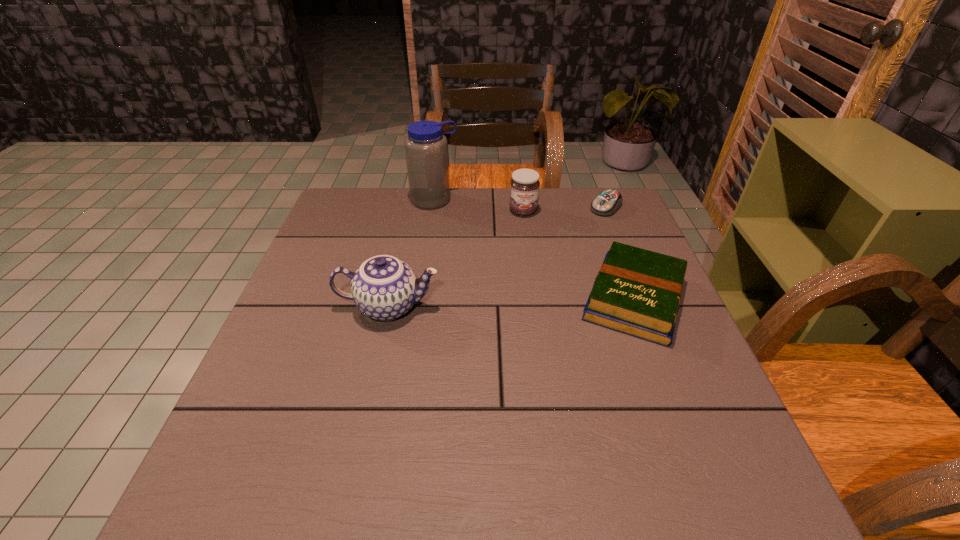
You are a GUI agent. You are given a task and a screenshot of the screen. Output one action in this format:
    pyautogui.click(x=<x>, y=<y>)
    Task: Click on the vacant spot on the desktop that is between the fourth shortest object and the book and is positioned with a carrying loop on the side of the water bottle
    The height and width of the screenshot is (540, 960).
    Given the screenshot: What is the action you would take?
    pyautogui.click(x=477, y=304)

What are the coordinates of `vacant space on the desktop that is between the chinaware and the book and is positioned on the front label of the jam` in the screenshot? It's located at (548, 302).

Locate an element on the screen. This screenshot has height=540, width=960. free spot on the desktop that is between the chinaware and the book and is positioned on the wheel side of the computer mouse is located at coordinates (500, 303).